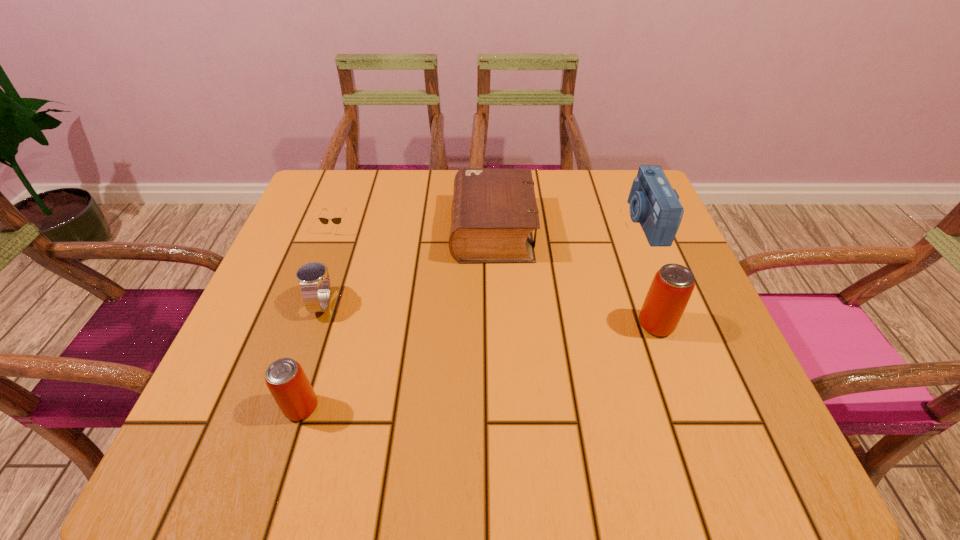
Where is `free space located 0.330m on the spine side of the third object from right to left`? free space located 0.330m on the spine side of the third object from right to left is located at coordinates (316, 230).

Where is `free space located 0.210m on the spine side of the third object from right to left`? This screenshot has height=540, width=960. free space located 0.210m on the spine side of the third object from right to left is located at coordinates 366,230.

Locate an element on the screen. The height and width of the screenshot is (540, 960). vacant space located 0.050m on the spine side of the third object from right to left is located at coordinates (431, 230).

The height and width of the screenshot is (540, 960). Identify the location of free spot located 0.150m on the lens of the camera. (570, 221).

Locate an element on the screen. The image size is (960, 540). free space located on the lens of the camera is located at coordinates (477, 221).

What are the coordinates of `blank area located 0.320m on the lens of the camera` in the screenshot? It's located at (501, 221).

Find the location of a particular element. The height and width of the screenshot is (540, 960). vacant space located 0.230m in front of the lenses of the sunglasses is located at coordinates (307, 310).

Where is `vacant space located 0.180m on the right of the watch`? This screenshot has height=540, width=960. vacant space located 0.180m on the right of the watch is located at coordinates (424, 303).

Identify the location of Bible at the far edge. The image size is (960, 540). (494, 211).

Where is `camera located in the far edge section of the desktop`? The height and width of the screenshot is (540, 960). camera located in the far edge section of the desktop is located at coordinates [x=654, y=204].